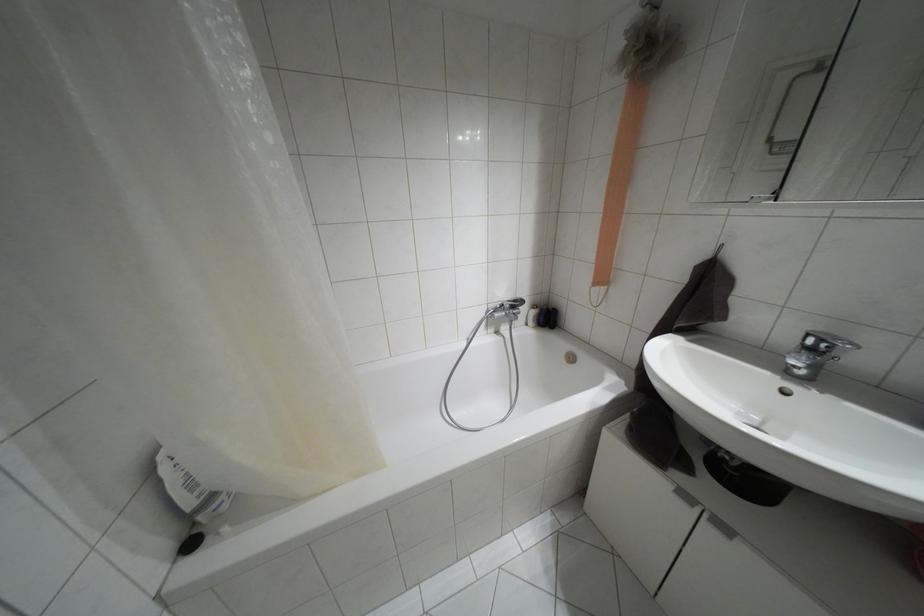
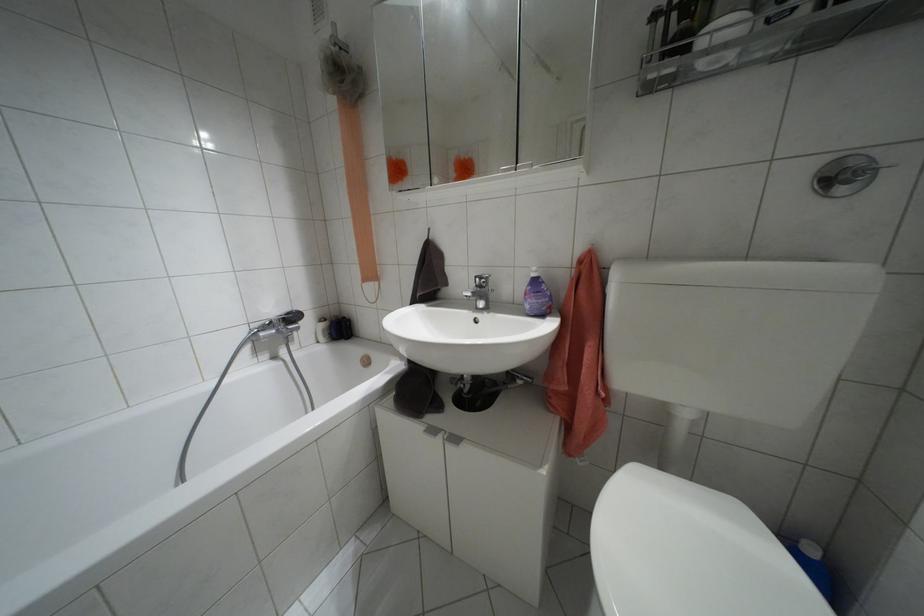
Question: I am providing you with two images of the same scene from different viewpoints. Which of the following objects are not visible in image2?

Choices:
 (A) bathtub faucet handle
 (B) white cabinet handle
 (C) beige mesh loofah
 (D) none of these

Answer: (D)